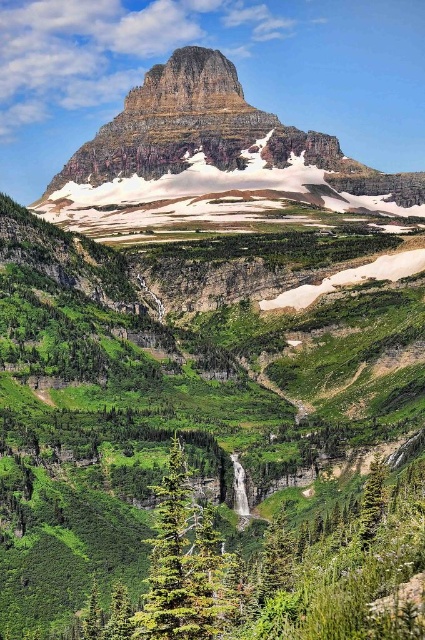
Is the position of rugged stone mountain at center less distant than that of green textured tree at center?

That is False.

Who is more forward, (x=79, y=179) or (x=197, y=515)?

Point (x=197, y=515)

At what (x,y) coordinates should I click in order to perform the action: click on rugged stone mountain at center. Please return your answer as a coordinate pair (x, y). Image resolution: width=425 pixels, height=640 pixels. Looking at the image, I should click on (193, 128).